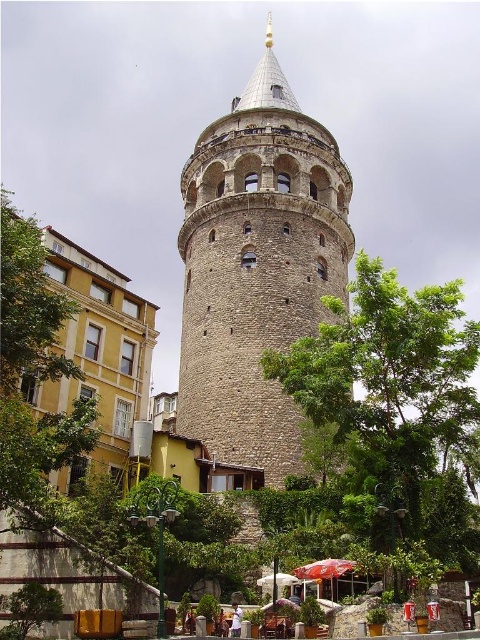
Based on the photo, does brown stone tower at center have a greater height compared to green leafy tree at lower left?

Yes, brown stone tower at center is taller than green leafy tree at lower left.

Does brown stone tower at center have a lesser width compared to green leafy tree at lower left?

Correct, brown stone tower at center's width is less than green leafy tree at lower left's.

Does point (183, 221) come closer to viewer compared to point (12, 365)?

No.

Where is `brown stone tower at center`? brown stone tower at center is located at coordinates (256, 268).

What do you see at coordinates (256, 268) in the screenshot?
I see `brown stone tower at center` at bounding box center [256, 268].

Measure the distance between brown stone tower at center and camera.

They are 151.80 feet apart.

Locate an element on the screen. This screenshot has height=640, width=480. brown stone tower at center is located at coordinates (256, 268).

Image resolution: width=480 pixels, height=640 pixels. What do you see at coordinates (256, 268) in the screenshot?
I see `brown stone tower at center` at bounding box center [256, 268].

Is brown stone tower at center to the left of red fabric umbrella at lower center from the viewer's perspective?

Indeed, brown stone tower at center is positioned on the left side of red fabric umbrella at lower center.

Which is behind, point (196, 220) or point (339, 561)?

The point (196, 220) is behind.

Image resolution: width=480 pixels, height=640 pixels. Identify the location of brown stone tower at center. (256, 268).